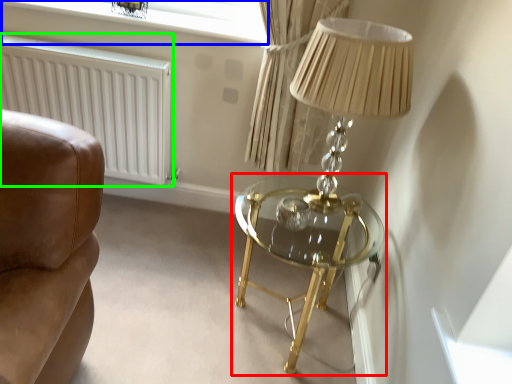
Question: Which object is positioned farthest from table (highlighted by a red box)? Select from window screen (highlighted by a blue box) and radiator (highlighted by a green box).

Choices:
 (A) window screen
 (B) radiator

Answer: (A)